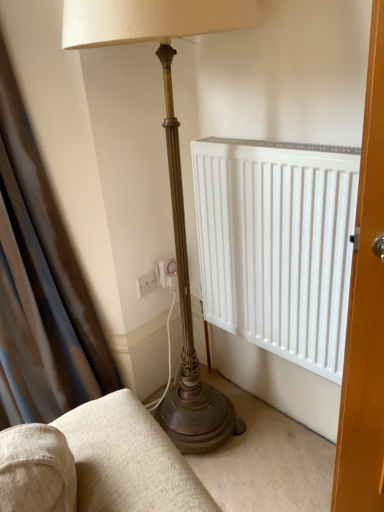
At what (x,y) coordinates should I click in order to perform the action: click on satin dark brown curtain at left. Please return your answer as a coordinate pair (x, y). Looking at the image, I should click on (40, 286).

Describe the element at coordinates (40, 286) in the screenshot. I see `satin dark brown curtain at left` at that location.

Where is `white plastic electric outlet at lower center`? The width and height of the screenshot is (384, 512). white plastic electric outlet at lower center is located at coordinates (147, 283).

What do you see at coordinates (147, 283) in the screenshot?
I see `white plastic electric outlet at lower center` at bounding box center [147, 283].

Where is `satin dark brown curtain at left`? The width and height of the screenshot is (384, 512). satin dark brown curtain at left is located at coordinates (40, 286).

Considering the positions of objects white plastic electric outlet at lower center and satin dark brown curtain at left in the image provided, who is more to the left, white plastic electric outlet at lower center or satin dark brown curtain at left?

From the viewer's perspective, satin dark brown curtain at left appears more on the left side.

Which object is closer to the camera taking this photo, white plastic electric outlet at lower center or satin dark brown curtain at left?

Positioned in front is satin dark brown curtain at left.

Which is in front, point (139, 296) or point (37, 239)?

The point (37, 239) is closer to the camera.

From the image's perspective, which is below, white plastic electric outlet at lower center or satin dark brown curtain at left?

From the image's view, white plastic electric outlet at lower center is below.

From a real-world perspective, is white plastic electric outlet at lower center positioned over satin dark brown curtain at left based on gravity?

Actually, white plastic electric outlet at lower center is physically below satin dark brown curtain at left in the real world.

Which of these two, white plastic electric outlet at lower center or satin dark brown curtain at left, is thinner?

With smaller width is white plastic electric outlet at lower center.

Does white plastic electric outlet at lower center have a greater height compared to satin dark brown curtain at left?

Incorrect, the height of white plastic electric outlet at lower center is not larger of that of satin dark brown curtain at left.

Considering the sizes of white plastic electric outlet at lower center and satin dark brown curtain at left in the image, is white plastic electric outlet at lower center bigger or smaller than satin dark brown curtain at left?

Considering their sizes, white plastic electric outlet at lower center takes up less space than satin dark brown curtain at left.

Can we say white plastic electric outlet at lower center lies outside satin dark brown curtain at left?

Yes, white plastic electric outlet at lower center is not within satin dark brown curtain at left.

Is white plastic electric outlet at lower center positioned far away from satin dark brown curtain at left?

They are positioned close to each other.

Is white plastic electric outlet at lower center positioned with its back to satin dark brown curtain at left?

→ white plastic electric outlet at lower center does not have its back to satin dark brown curtain at left.

The image size is (384, 512). I want to click on curtain that appears above the white plastic electric outlet at lower center (from a real-world perspective), so click(40, 286).

Considering the positions of objects satin dark brown curtain at left and white plastic electric outlet at lower center in the image provided, who is more to the left, satin dark brown curtain at left or white plastic electric outlet at lower center?

satin dark brown curtain at left.

Is satin dark brown curtain at left in front of or behind white plastic electric outlet at lower center in the image?

Visually, satin dark brown curtain at left is located in front of white plastic electric outlet at lower center.

Is point (23, 244) positioned behind point (150, 283)?

No, (23, 244) is closer to viewer.

From the image's perspective, would you say satin dark brown curtain at left is positioned over white plastic electric outlet at lower center?

Yes, from the image's perspective, satin dark brown curtain at left is above white plastic electric outlet at lower center.

From a real-world perspective, is satin dark brown curtain at left over white plastic electric outlet at lower center?

Indeed, from a real-world perspective, satin dark brown curtain at left stands above white plastic electric outlet at lower center.

Considering the sizes of objects satin dark brown curtain at left and white plastic electric outlet at lower center in the image provided, who is wider, satin dark brown curtain at left or white plastic electric outlet at lower center?

satin dark brown curtain at left is wider.

In terms of height, does satin dark brown curtain at left look taller or shorter compared to white plastic electric outlet at lower center?

Considering their sizes, satin dark brown curtain at left has more height than white plastic electric outlet at lower center.

Does satin dark brown curtain at left have a smaller size compared to white plastic electric outlet at lower center?

Incorrect, satin dark brown curtain at left is not smaller in size than white plastic electric outlet at lower center.

Can we say satin dark brown curtain at left lies outside white plastic electric outlet at lower center?

That's correct, satin dark brown curtain at left is outside of white plastic electric outlet at lower center.

Is satin dark brown curtain at left beside white plastic electric outlet at lower center?

satin dark brown curtain at left and white plastic electric outlet at lower center are not in contact.

Is satin dark brown curtain at left oriented away from white plastic electric outlet at lower center?

No, satin dark brown curtain at left's orientation is not away from white plastic electric outlet at lower center.

How many degrees apart are the facing directions of satin dark brown curtain at left and white plastic electric outlet at lower center?

58.5 degrees.

How much distance is there between satin dark brown curtain at left and white plastic electric outlet at lower center?

satin dark brown curtain at left and white plastic electric outlet at lower center are 43.13 centimeters apart from each other.

At what (x,y) coordinates should I click in order to perform the action: click on electric outlet behind the satin dark brown curtain at left. Please return your answer as a coordinate pair (x, y). This screenshot has width=384, height=512. Looking at the image, I should click on (147, 283).

The image size is (384, 512). What are the coordinates of `electric outlet directly beneath the satin dark brown curtain at left (from a real-world perspective)` in the screenshot? It's located at (147, 283).

I want to click on curtain that appears above the white plastic electric outlet at lower center (from the image's perspective), so click(x=40, y=286).